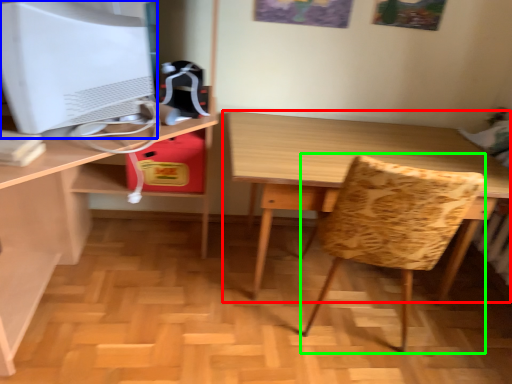
Question: Considering the real-world distances, which object is farthest from table (highlighted by a red box)? computer monitor (highlighted by a blue box) or swivel chair (highlighted by a green box)?

Choices:
 (A) computer monitor
 (B) swivel chair

Answer: (A)